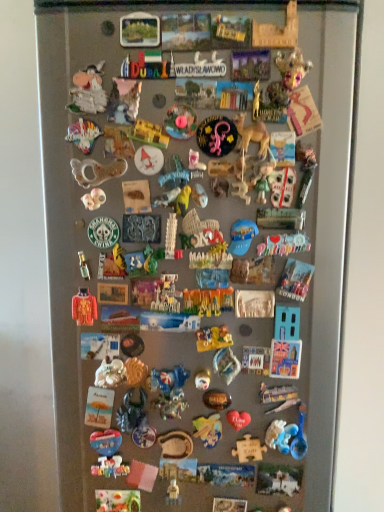
Question: Can you confirm if blue plastic magnet at center, the 23th toy in the bottom-to-top sequence, is smaller than translucent plastic toy at center, marked as the 10th toy in a bottom-to-top arrangement?

Choices:
 (A) no
 (B) yes

Answer: (B)

Question: Does blue plastic magnet at center, which is counted as the seventeenth toy, starting from the top, come in front of translucent plastic toy at center, marked as the 10th toy in a bottom-to-top arrangement?

Choices:
 (A) yes
 (B) no

Answer: (A)

Question: Considering the relative positions of blue plastic magnet at center, which is counted as the seventeenth toy, starting from the top, and translucent plastic toy at center, the 30th toy from the top, in the image provided, is blue plastic magnet at center, which is counted as the seventeenth toy, starting from the top, behind translucent plastic toy at center, the 30th toy from the top,?

Choices:
 (A) yes
 (B) no

Answer: (B)

Question: Does blue plastic magnet at center, the 23th toy in the bottom-to-top sequence, have a larger size compared to translucent plastic toy at center, the 30th toy from the top?

Choices:
 (A) no
 (B) yes

Answer: (A)

Question: Can you confirm if blue plastic magnet at center, which is counted as the seventeenth toy, starting from the top, is positioned to the left of translucent plastic toy at center, marked as the 10th toy in a bottom-to-top arrangement?

Choices:
 (A) yes
 (B) no

Answer: (B)

Question: From a real-world perspective, is blue plastic magnet at center, which is counted as the seventeenth toy, starting from the top, below translucent plastic toy at center, the 30th toy from the top?

Choices:
 (A) no
 (B) yes

Answer: (A)

Question: Is metallic silver puzzle piece at center, the 12th toy from the bottom, turned away from matte yellow toy dinosaur at center, the nineteenth toy when ordered from top to bottom?

Choices:
 (A) yes
 (B) no

Answer: (B)

Question: From the image's perspective, does metallic silver puzzle piece at center, which is the 28th toy from top to bottom, appear higher than matte yellow toy dinosaur at center, the nineteenth toy when ordered from top to bottom?

Choices:
 (A) yes
 (B) no

Answer: (B)

Question: From the image's perspective, is metallic silver puzzle piece at center, which is the 28th toy from top to bottom, below matte yellow toy dinosaur at center, the 21th toy positioned from the bottom?

Choices:
 (A) no
 (B) yes

Answer: (B)

Question: Does metallic silver puzzle piece at center, which is the 28th toy from top to bottom, appear on the right side of matte yellow toy dinosaur at center, the nineteenth toy when ordered from top to bottom?

Choices:
 (A) yes
 (B) no

Answer: (A)

Question: Can you confirm if metallic silver puzzle piece at center, which is the 28th toy from top to bottom, is thinner than matte yellow toy dinosaur at center, the 21th toy positioned from the bottom?

Choices:
 (A) yes
 (B) no

Answer: (A)

Question: Is metallic silver puzzle piece at center, which is the 28th toy from top to bottom, facing towards matte yellow toy dinosaur at center, the nineteenth toy when ordered from top to bottom?

Choices:
 (A) yes
 (B) no

Answer: (B)

Question: From a real-world perspective, is shiny plastic dinosaur at center, the 32th toy when ordered from top to bottom, located higher than metallic silver puzzle piece at center, which is the 28th toy from top to bottom?

Choices:
 (A) yes
 (B) no

Answer: (B)